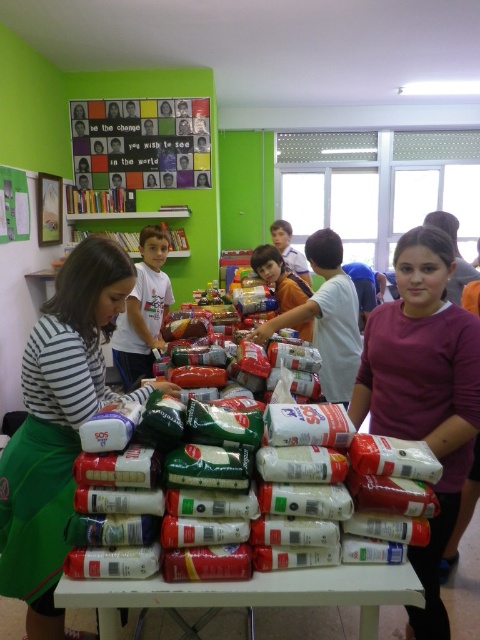
Question: Which of the following is the farthest from the observer?

Choices:
 (A) white plastic table at center
 (B) purple matte shirt at center
 (C) matte brown shirt at center
 (D) white cotton shirt at center

Answer: (D)

Question: Can you confirm if purple matte shirt at center is thinner than white cotton shirt at center?

Choices:
 (A) yes
 (B) no

Answer: (A)

Question: Which point is closer to the camera?

Choices:
 (A) (12, 596)
 (B) (425, 320)
 (C) (146, 356)

Answer: (A)

Question: Which object is closer to the camera taking this photo?

Choices:
 (A) striped fabric shirt at center
 (B) purple matte shirt at center
 (C) white plastic table at center

Answer: (C)

Question: Can you confirm if white plastic table at center is positioned to the left of white cotton shirt at center?

Choices:
 (A) yes
 (B) no

Answer: (B)

Question: Is striped fabric shirt at center below purple matte shirt at center?

Choices:
 (A) no
 (B) yes

Answer: (B)